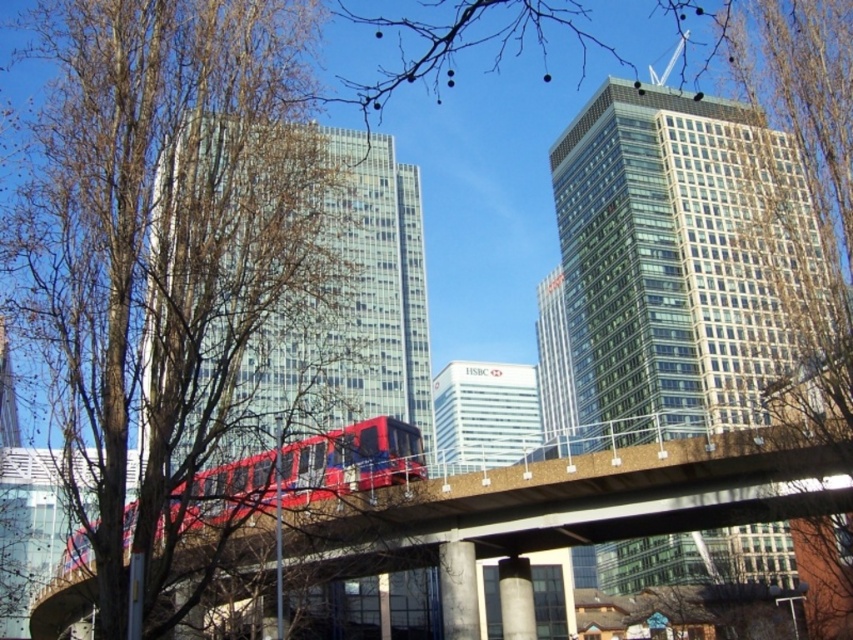
Question: Which point is closer to the camera taking this photo?

Choices:
 (A) (323, 195)
 (B) (209, 474)

Answer: (B)

Question: Which of the following is the farthest from the observer?

Choices:
 (A) (38, 628)
 (B) (125, 228)
 (C) (374, 461)

Answer: (A)

Question: Does brown leafless tree at left appear on the left side of metal/concrete bridge at center?

Choices:
 (A) no
 (B) yes

Answer: (B)

Question: Is metal/concrete bridge at center in front of metallic red train at center?

Choices:
 (A) no
 (B) yes

Answer: (A)

Question: Is metal/concrete bridge at center closer to the viewer compared to metallic red train at center?

Choices:
 (A) no
 (B) yes

Answer: (A)

Question: Which point is farther from the camera taking this photo?

Choices:
 (A) (821, 438)
 (B) (306, 440)

Answer: (B)